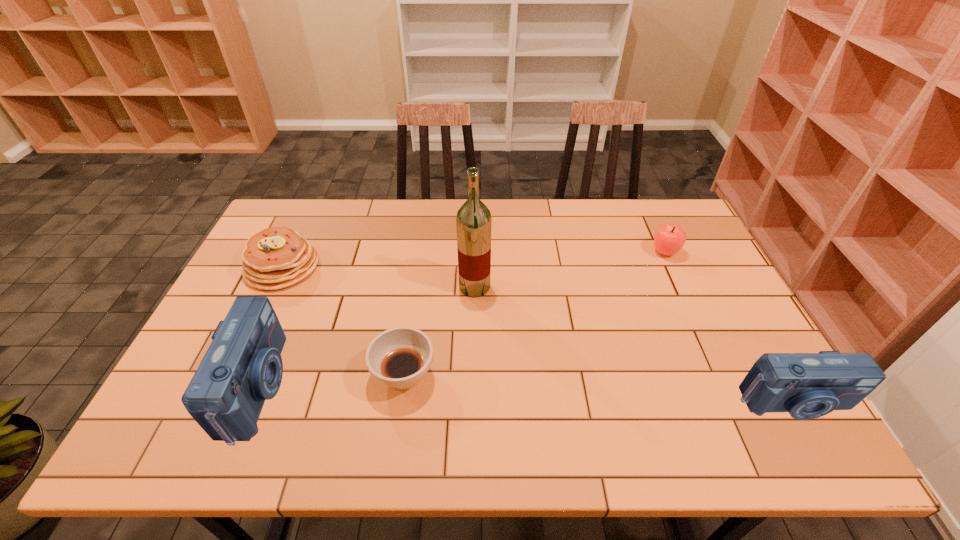
This screenshot has width=960, height=540. Find the location of `the second tallest object`. the second tallest object is located at coordinates (243, 367).

Where is `the taller camera`? the taller camera is located at coordinates (243, 367).

The image size is (960, 540). I want to click on the shorter camera, so click(807, 385).

This screenshot has width=960, height=540. In order to click on the fourth shortest object in this screenshot , I will do [x=807, y=385].

Where is `apple`? Image resolution: width=960 pixels, height=540 pixels. apple is located at coordinates (668, 239).

Locate an element on the screen. The width and height of the screenshot is (960, 540). liquor is located at coordinates (473, 221).

At what (x,y) coordinates should I click in order to perform the action: click on the tallest object. Please return your answer as a coordinate pair (x, y). This screenshot has height=540, width=960. Looking at the image, I should click on (473, 221).

Where is `pancake`? This screenshot has width=960, height=540. pancake is located at coordinates (277, 257).

The image size is (960, 540). Identify the location of the shortest object. (399, 357).

Where is `the fourth object from right to left`? The image size is (960, 540). the fourth object from right to left is located at coordinates (399, 357).